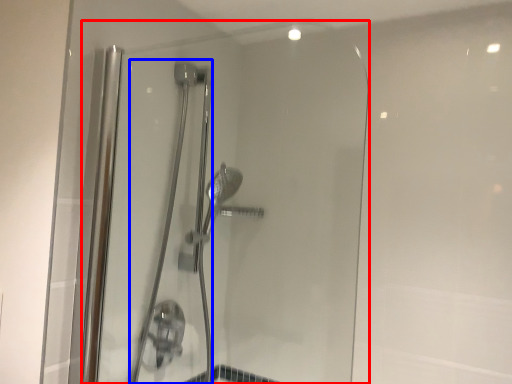
Question: Which object is closer to the camera taking this photo, shower door (highlighted by a red box) or shower door (highlighted by a blue box)?

Choices:
 (A) shower door
 (B) shower door

Answer: (A)